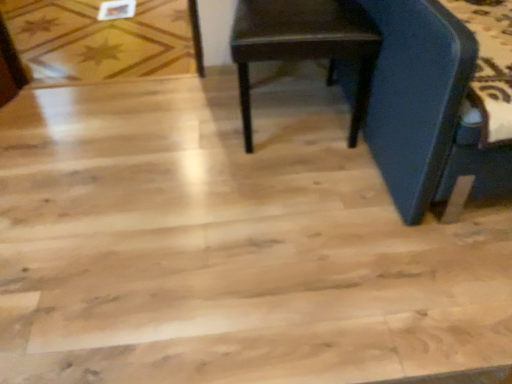
Locate an element on the screen. The width and height of the screenshot is (512, 384). vacant space in dark brown wood chair at center (from a real-world perspective) is located at coordinates (289, 113).